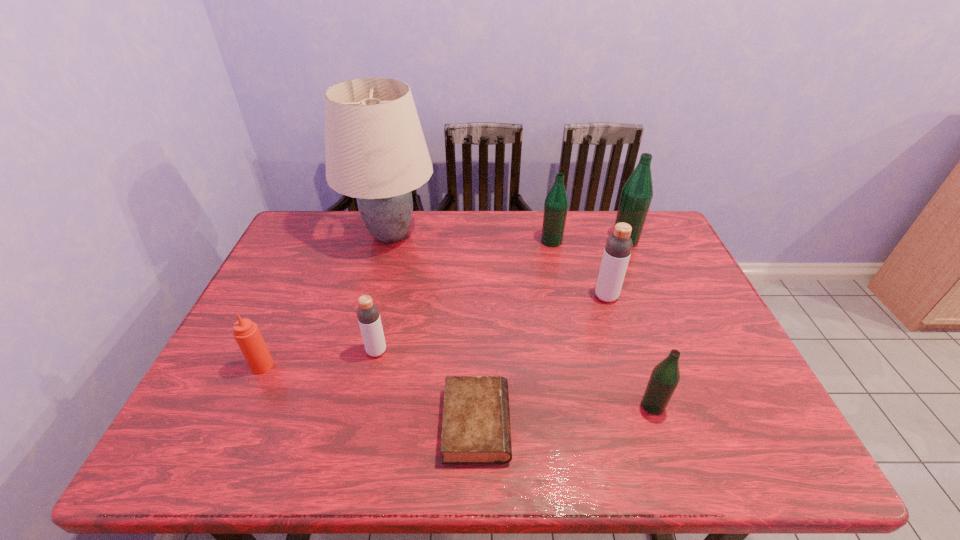
Find the location of a particular element. The width and height of the screenshot is (960, 540). vacant space located on the left of the second green bottle from right to left is located at coordinates (474, 406).

The width and height of the screenshot is (960, 540). I want to click on free space located 0.140m on the right of the leftmost object, so click(331, 366).

I want to click on free space located on the spine side of the shortest object, so click(x=682, y=424).

You are a GUI agent. You are given a task and a screenshot of the screen. Output one action in this format:
    pyautogui.click(x=<x>, y=<y>)
    Task: Click on the lampshade located in the far edge section of the desktop
    
    Given the screenshot: What is the action you would take?
    pyautogui.click(x=375, y=149)

The image size is (960, 540). In order to click on object at the near edge in this screenshot , I will do `click(476, 429)`.

This screenshot has height=540, width=960. In order to click on object that is positioned at the left edge in this screenshot , I will do `click(246, 333)`.

Image resolution: width=960 pixels, height=540 pixels. I want to click on object positioned at the right edge, so click(637, 193).

Where is `object that is at the far right corner`? This screenshot has height=540, width=960. object that is at the far right corner is located at coordinates (637, 193).

The width and height of the screenshot is (960, 540). Find the location of `vacant region at the far edge`. vacant region at the far edge is located at coordinates (490, 219).

This screenshot has height=540, width=960. What are the coordinates of `vacant space at the near edge of the desktop` in the screenshot? It's located at (643, 465).